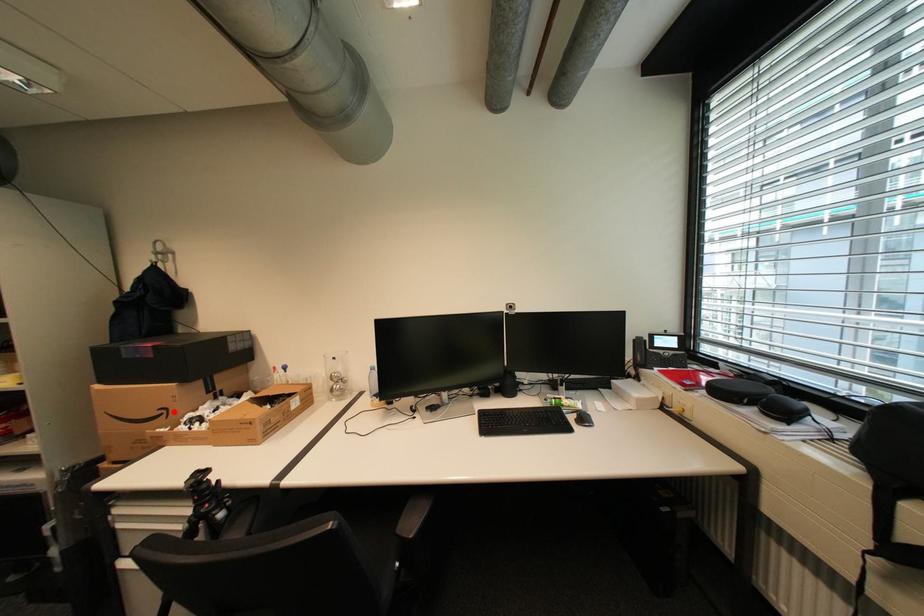
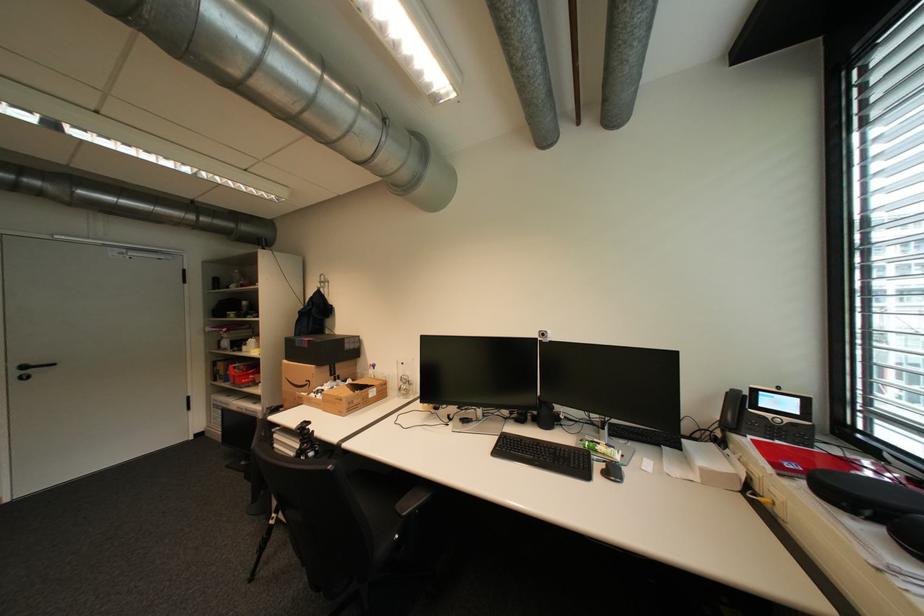
In the second image, find the point that corresponds to the highlighted location in the first image.

(317, 383)